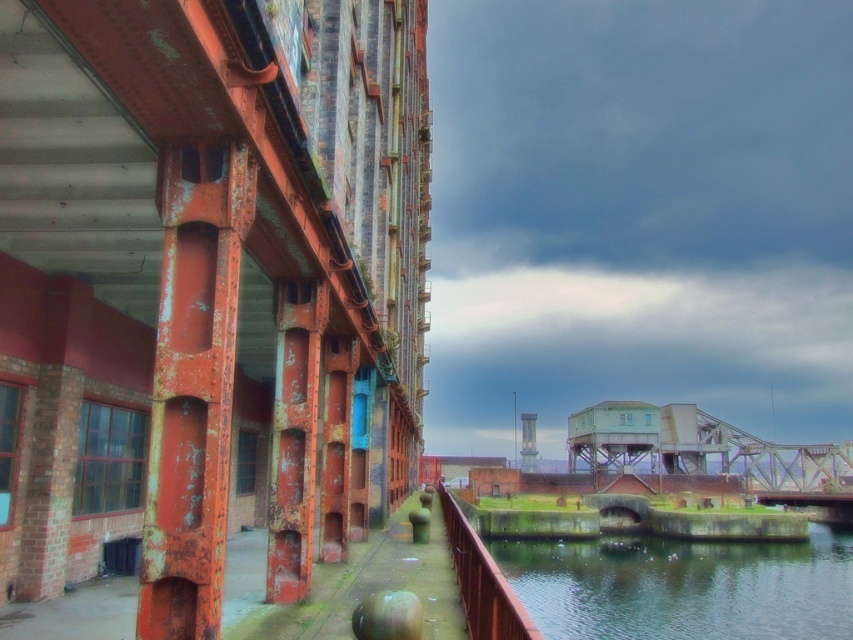
Is clear water at lower right closer to camera compared to rustic metal bridge at center?

Yes, it is.

Does clear water at lower right appear on the left side of rustic metal bridge at center?

Correct, you'll find clear water at lower right to the left of rustic metal bridge at center.

This screenshot has width=853, height=640. What do you see at coordinates (683, 588) in the screenshot?
I see `clear water at lower right` at bounding box center [683, 588].

Image resolution: width=853 pixels, height=640 pixels. Identify the location of clear water at lower right. (683, 588).

Is rustic metal bridge at center positioned at the back of rusty metal rail at lower center?

Yes, rustic metal bridge at center is behind rusty metal rail at lower center.

Between point (637, 413) and point (463, 544), which one is positioned behind?

The point (637, 413) is behind.

Where is `rustic metal bridge at center`? rustic metal bridge at center is located at coordinates (697, 448).

Measure the distance between clear water at lower right and camera.

clear water at lower right and camera are 24.29 meters apart.

Is clear water at lower right thinner than rusty metal rail at lower center?

In fact, clear water at lower right might be wider than rusty metal rail at lower center.

Between point (611, 611) and point (460, 588), which one is positioned in front?

Point (460, 588) is in front.

The image size is (853, 640). I want to click on clear water at lower right, so click(x=683, y=588).